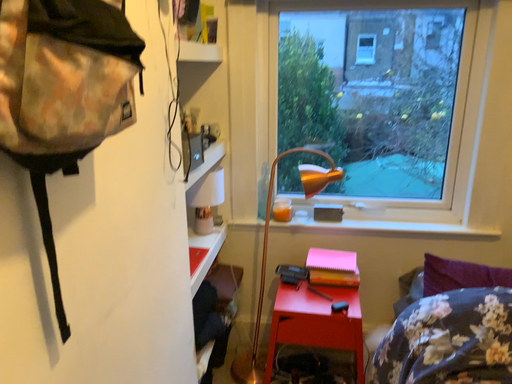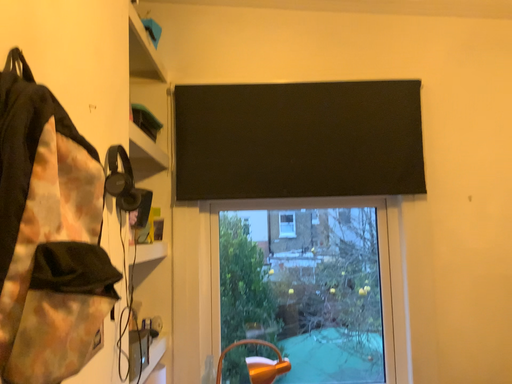
Question: How did the camera likely rotate when shooting the video?

Choices:
 (A) rotated downward
 (B) rotated upward

Answer: (B)